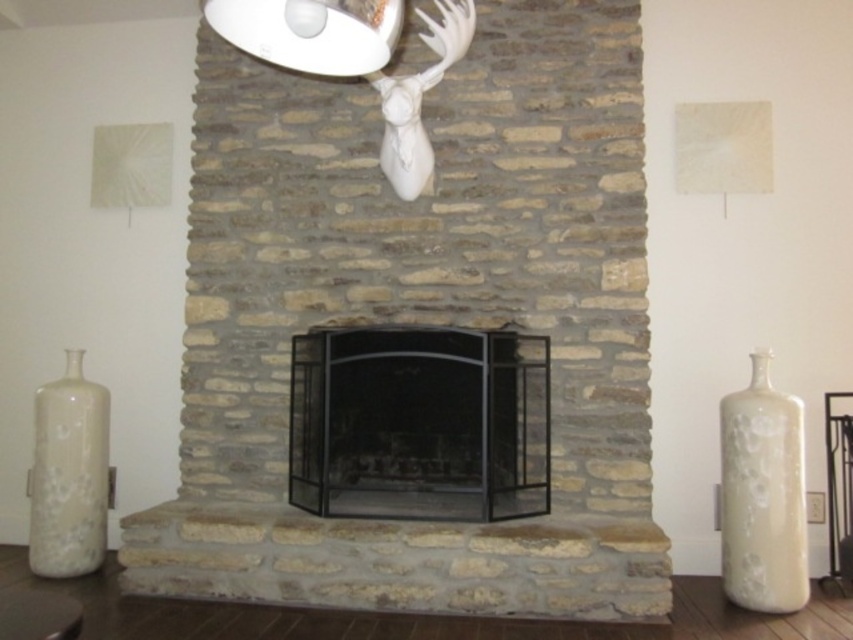
Question: Can you confirm if black metal fireplace at center is bigger than white glossy lampshade at upper center?

Choices:
 (A) yes
 (B) no

Answer: (A)

Question: Which is farther from the natural stone fireplace at center?

Choices:
 (A) white glossy vase at left
 (B) black metal fireplace at center
 (C) white glossy vase at right
 (D) white glossy lampshade at upper center

Answer: (D)

Question: Estimate the real-world distances between objects in this image. Which object is closer to the white glossy lampshade at upper center?

Choices:
 (A) white glossy vase at right
 (B) white glossy vase at left
 (C) natural stone fireplace at center
 (D) black metal fireplace at center

Answer: (D)

Question: Can you confirm if white glossy vase at left is smaller than white glossy lampshade at upper center?

Choices:
 (A) no
 (B) yes

Answer: (A)

Question: Can you confirm if black metal fireplace at center is positioned above white glossy lampshade at upper center?

Choices:
 (A) no
 (B) yes

Answer: (A)

Question: Estimate the real-world distances between objects in this image. Which object is closer to the natural stone fireplace at center?

Choices:
 (A) white glossy vase at left
 (B) white glossy lampshade at upper center
 (C) black metal fireplace at center

Answer: (C)